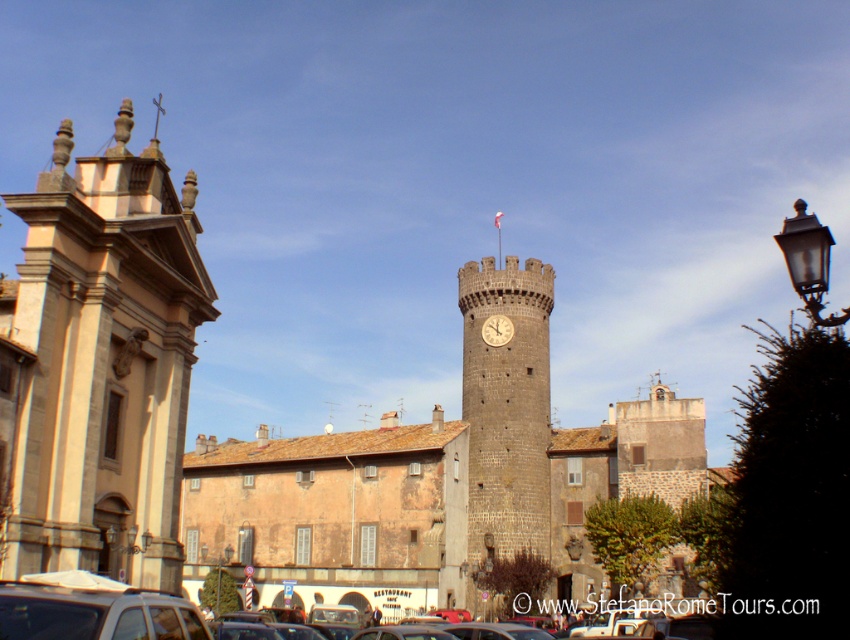
Who is positioned more to the left, dark gray stone clock tower at center or silver metallic car at lower left?

silver metallic car at lower left is more to the left.

Who is higher up, dark gray stone clock tower at center or silver metallic car at lower left?

dark gray stone clock tower at center is higher up.

Between point (540, 344) and point (109, 600), which one is positioned behind?

The point (540, 344) is more distant.

The image size is (850, 640). I want to click on dark gray stone clock tower at center, so click(x=505, y=412).

Is point (432, 454) farther from viewer compared to point (143, 596)?

Yes.

Does dark gray stone tower at center have a lesser width compared to metallic silver car at center?

In fact, dark gray stone tower at center might be wider than metallic silver car at center.

At what (x,y) coordinates should I click in order to perform the action: click on dark gray stone tower at center. Please return your answer as a coordinate pair (x, y). Looking at the image, I should click on (287, 436).

You are a GUI agent. You are given a task and a screenshot of the screen. Output one action in this format:
    pyautogui.click(x=<x>, y=<y>)
    Task: Click on the dark gray stone tower at center
    
    Given the screenshot: What is the action you would take?
    pyautogui.click(x=287, y=436)

Does dark gray stone tower at center have a greater height compared to gold metallic clock at center?

Correct, dark gray stone tower at center is much taller as gold metallic clock at center.

Between point (72, 554) and point (490, 317), which one is positioned in front?

Point (72, 554) is more forward.

Where is `dark gray stone tower at center`? This screenshot has height=640, width=850. dark gray stone tower at center is located at coordinates (287, 436).